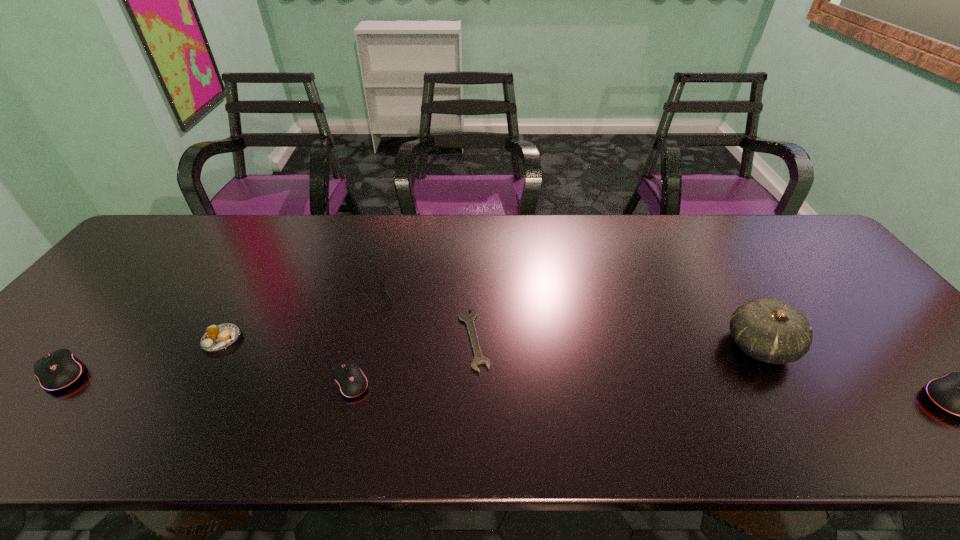
Locate an element on the screen. vacant spot for a new mouse_(computer_equipment) to ensure equal spacing is located at coordinates [x=649, y=390].